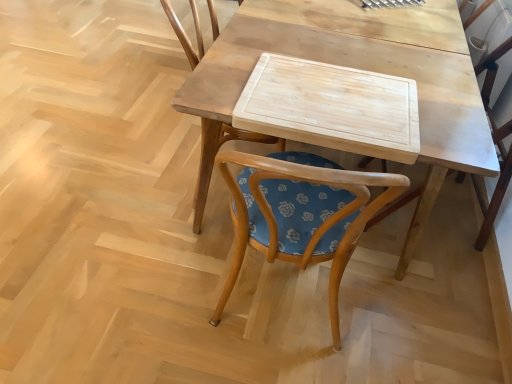
Question: Can you confirm if natural wood cutting board at center is thinner than wooden cutting board at center?

Choices:
 (A) yes
 (B) no

Answer: (A)

Question: Is natural wood cutting board at center taller than wooden cutting board at center?

Choices:
 (A) no
 (B) yes

Answer: (A)

Question: Considering the relative sizes of natural wood cutting board at center and wooden cutting board at center in the image provided, is natural wood cutting board at center shorter than wooden cutting board at center?

Choices:
 (A) no
 (B) yes

Answer: (B)

Question: From the image's perspective, is natural wood cutting board at center on wooden cutting board at center?

Choices:
 (A) no
 (B) yes

Answer: (A)

Question: Would you say natural wood cutting board at center is outside wooden cutting board at center?

Choices:
 (A) no
 (B) yes

Answer: (A)

Question: Looking at the image, does natural wood cutting board at center seem bigger or smaller compared to wooden cutting board at center?

Choices:
 (A) small
 (B) big

Answer: (A)

Question: Does point (261, 130) appear closer or farther from the camera than point (314, 34)?

Choices:
 (A) closer
 (B) farther

Answer: (A)

Question: Do you think natural wood cutting board at center is within wooden cutting board at center, or outside of it?

Choices:
 (A) inside
 (B) outside

Answer: (A)

Question: Based on their positions, is natural wood cutting board at center located to the left or right of wooden cutting board at center?

Choices:
 (A) right
 (B) left

Answer: (B)

Question: Considering the positions of point (301, 100) and point (210, 135), is point (301, 100) closer or farther from the camera than point (210, 135)?

Choices:
 (A) closer
 (B) farther

Answer: (A)

Question: From the image's perspective, is natural wood cutting board at center above or below wooden chair at center, the second chair viewed from the right?

Choices:
 (A) above
 (B) below

Answer: (B)

Question: From a real-world perspective, is natural wood cutting board at center positioned above or below wooden chair at center, which is counted as the first chair, starting from the left?

Choices:
 (A) below
 (B) above

Answer: (B)

Question: Is natural wood cutting board at center in front of or behind wooden chair at center, the second chair viewed from the right, in the image?

Choices:
 (A) front
 (B) behind

Answer: (A)

Question: Relative to wooden chair at center, the second chair viewed from the right, is wooden chair at center, positioned as the 2th chair in left-to-right order, in front or behind?

Choices:
 (A) behind
 (B) front

Answer: (A)

Question: Considering the positions of point (480, 61) and point (205, 182), is point (480, 61) closer or farther from the camera than point (205, 182)?

Choices:
 (A) closer
 (B) farther

Answer: (B)